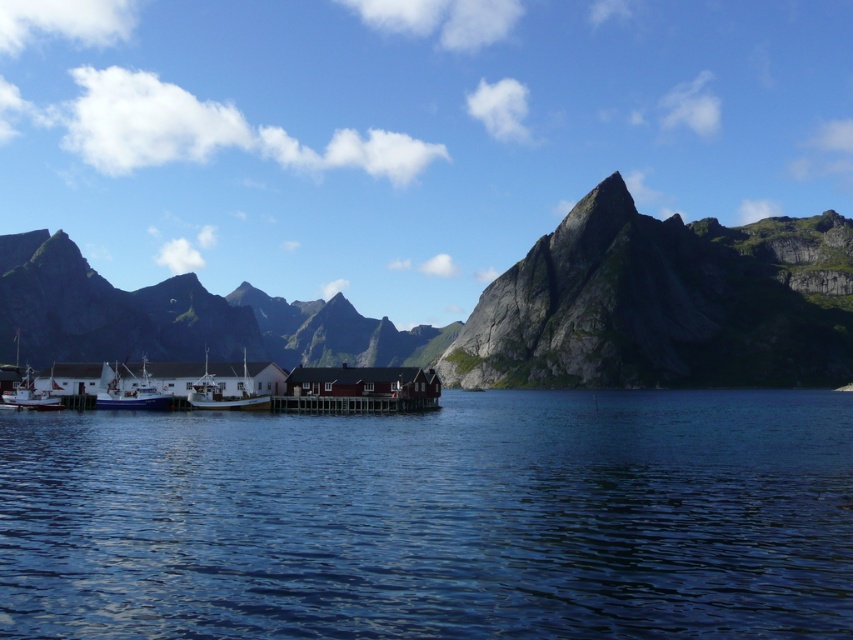
You are a hiker planning to take a photo of the rugged granite mountain at center and the gray rocky mountain at center. Which mountain should you stand closer to in order to capture both in a single frame?

You should stand closer to the gray rocky mountain at center because the rugged granite mountain at center is above it, so positioning yourself closer to the lower mountain will help include both in the frame.

You are standing at the point marked as point [500,307] in the image. What is the most prominent feature directly beneath your feet?

The rugged granite mountain at center is located at point [500,307], so the most prominent feature directly beneath your feet is the rugged granite mountain at center.

You are a photographer planning to take a landscape photo of the gray rocky mountain at center and the white matte boat at lower left. Which object will appear larger in the photo?

The gray rocky mountain at center will appear larger in the photo because it has a greater height compared to the white matte boat at lower left.